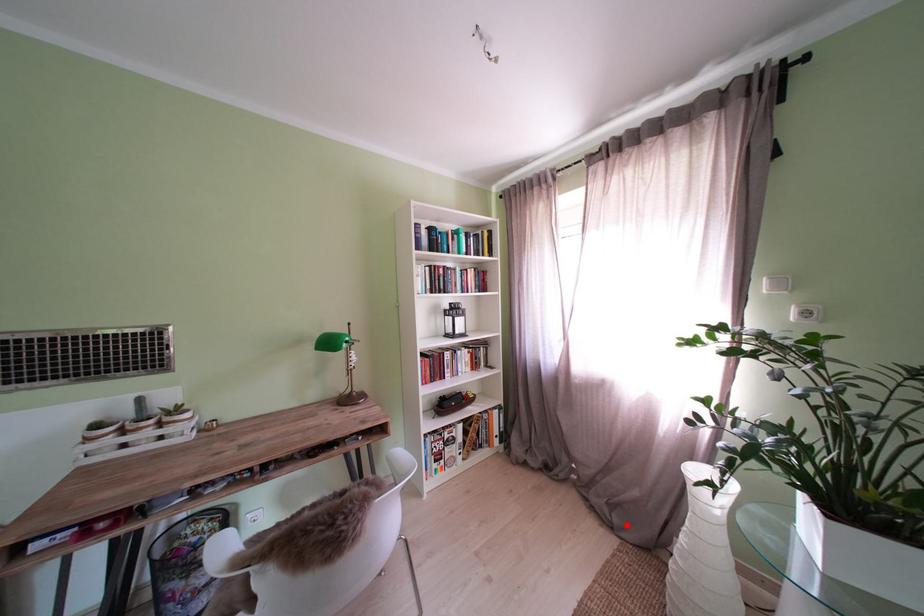
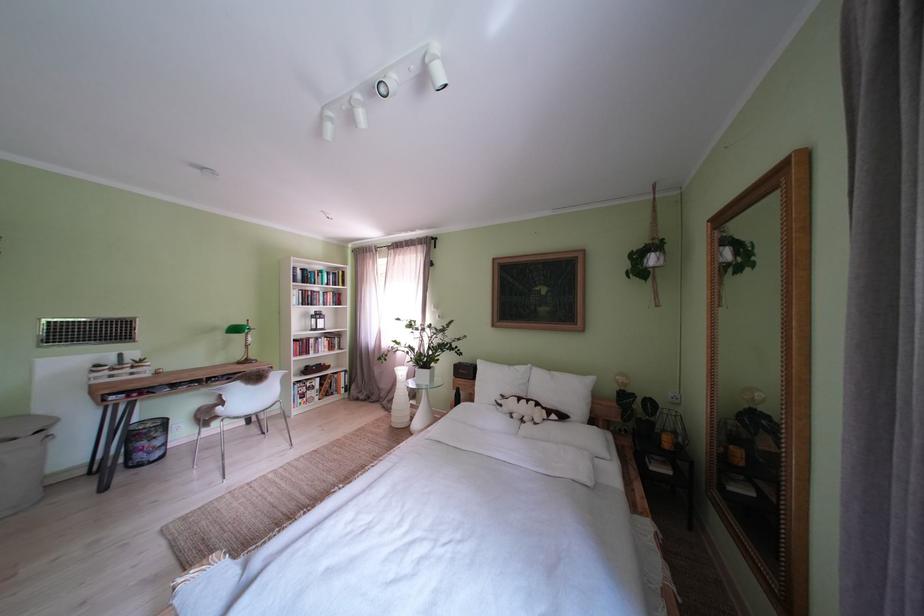
Where in the second image is the point corresponding to the highlighted location from the first image?

(400, 411)